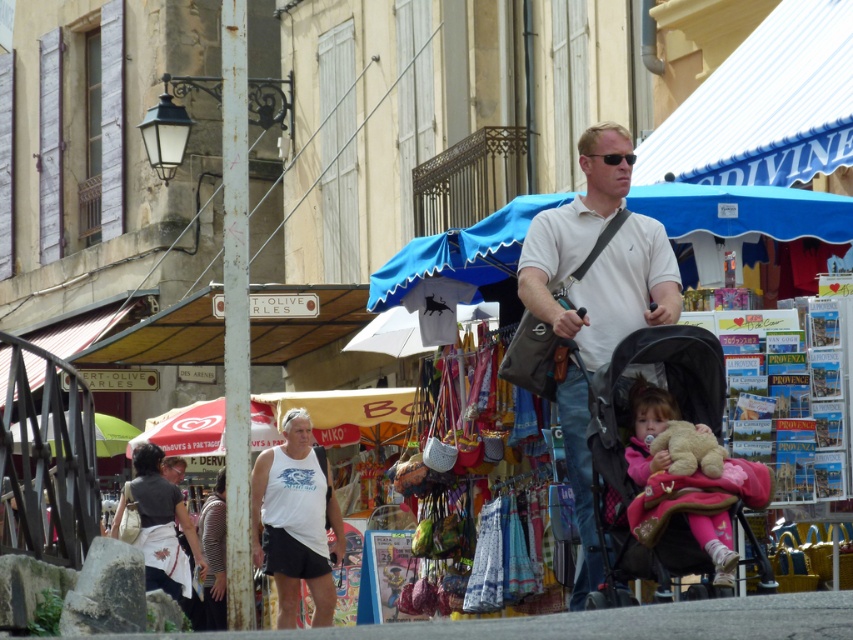
Is white cotton shirt at center further to the viewer compared to white matte tank top at center?

No.

Is white cotton shirt at center taller than white matte tank top at center?

Incorrect, white cotton shirt at center's height is not larger of white matte tank top at center's.

What do you see at coordinates (599, 257) in the screenshot? I see `white cotton shirt at center` at bounding box center [599, 257].

At what (x,y) coordinates should I click in order to perform the action: click on white cotton shirt at center. Please return your answer as a coordinate pair (x, y). Image resolution: width=853 pixels, height=640 pixels. Looking at the image, I should click on (599, 257).

Is point (628, 145) farther from viewer compared to point (758, 228)?

That is False.

Is white cotton shirt at center above blue fabric canopy at center?

No.

Measure the distance between point [636,241] and camera.

Point [636,241] is 84.27 feet from camera.

Where is `white cotton shirt at center`? The width and height of the screenshot is (853, 640). white cotton shirt at center is located at coordinates (599, 257).

Is white cotton shirt at center behind black fabric baby carriage at center?

Yes, white cotton shirt at center is further from the viewer.

Does white cotton shirt at center appear over black fabric baby carriage at center?

Indeed, white cotton shirt at center is positioned over black fabric baby carriage at center.

The height and width of the screenshot is (640, 853). I want to click on white cotton shirt at center, so [x=599, y=257].

The image size is (853, 640). I want to click on white cotton shirt at center, so click(599, 257).